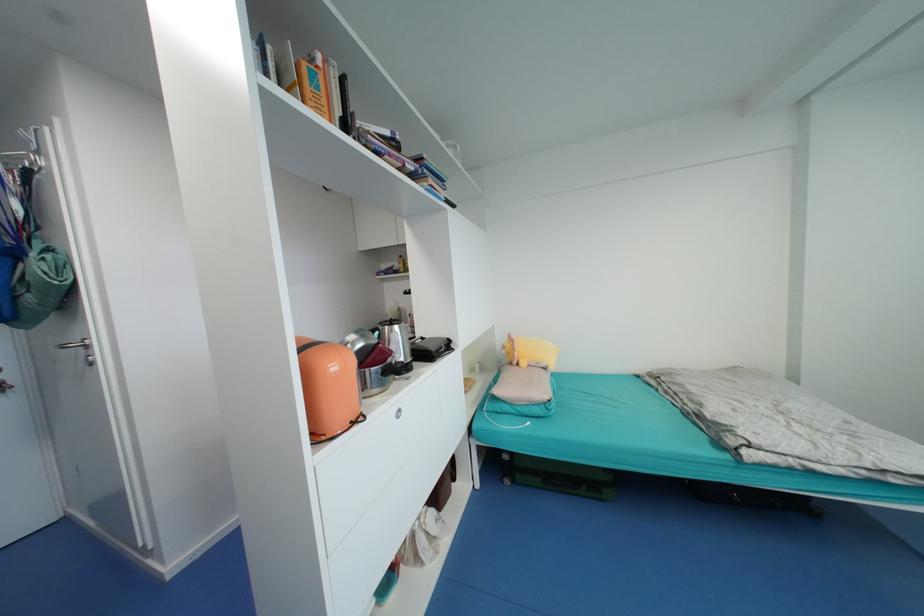
You are a GUI agent. You are given a task and a screenshot of the screen. Output one action in this format:
    pyautogui.click(x=<x>, y=<y>)
    Task: Click on the yellow plush pillow
    The image size is (924, 616).
    Given the screenshot: What is the action you would take?
    pyautogui.click(x=529, y=352)